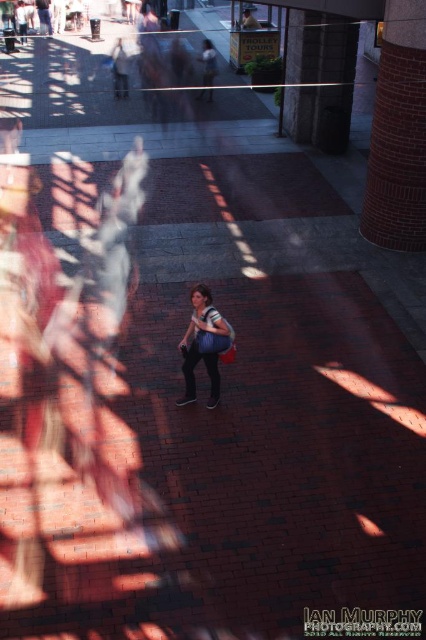
You are a photographer positioned at the center of the plaza. You want to capture a photo of the matte blue shirt at center while ensuring the brick textured pillar at right is also in the frame. Given your current position, can you fit both subjects into the shot without moving?

The brick textured pillar at right is 5.19 meters away from matte blue shirt at center. Since the photographer is at the center, the distance between the two subjects is manageable, so yes, both can be captured in the same frame without moving.

You are a photographer trying to capture both the brick textured pillar at right and the matte blue shirt at center in a single shot. Which object should you focus on first to ensure both are in sharp focus?

You should focus on the brick textured pillar at right first because it is closer to you than the matte blue shirt at center. By focusing on the closer object, the farther object will still be within the depth of field and appear sharp.

What is the spatial relationship between the brick textured pillar at right and the matte blue shirt at center?

The brick textured pillar at right is located to the right of the matte blue shirt at center.